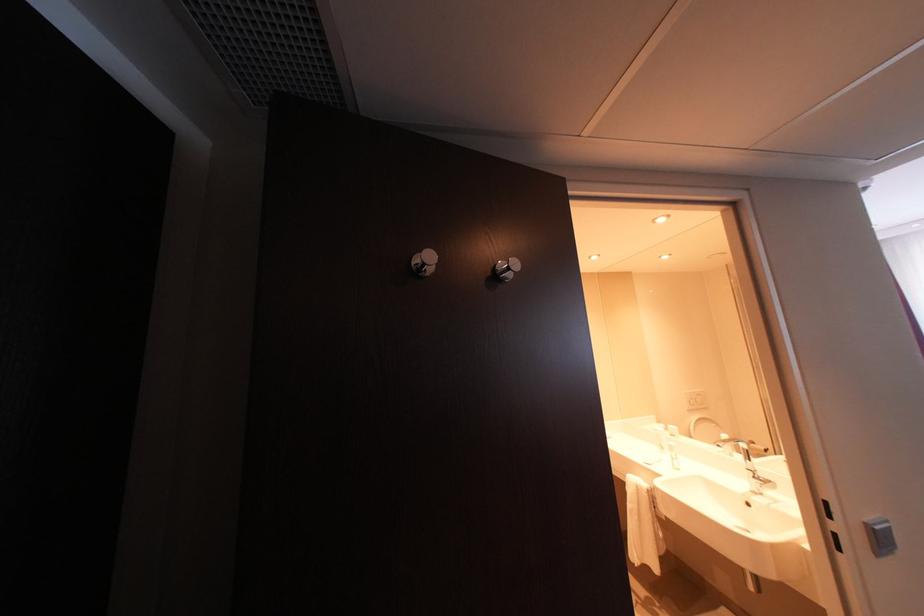
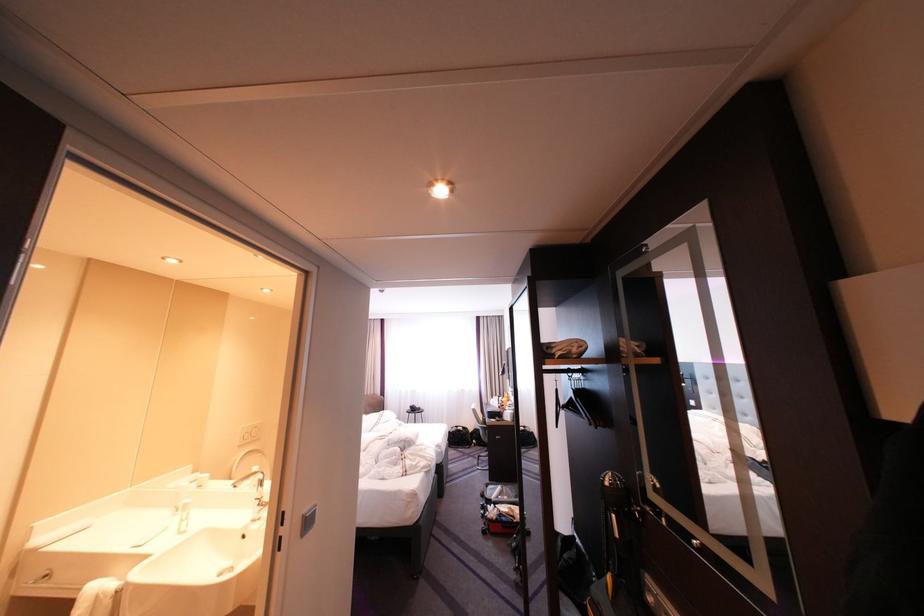
Where in the second image is the point corresponding to point (675, 450) from the first image?

(189, 511)